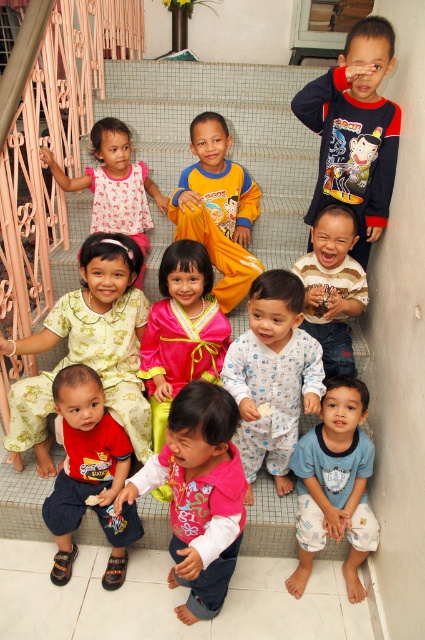
Question: Estimate the real-world distances between objects in this image. Which object is closer to the orange cotton pajamas at center?

Choices:
 (A) red cotton shirt at lower left
 (B) dark blue cotton shirt at upper right
 (C) light green floral dress at center

Answer: (B)

Question: Observing the image, what is the correct spatial positioning of blue dotted pajamas at center in reference to orange cotton pajamas at center?

Choices:
 (A) above
 (B) below

Answer: (B)

Question: Among these points, which one is farthest from the camera?

Choices:
 (A) (365, 45)
 (B) (102, 188)
 (C) (195, 483)

Answer: (B)

Question: Is white tiled stairs at center thinner than pink fabric dress at upper left?

Choices:
 (A) no
 (B) yes

Answer: (A)

Question: Which point appears farthest from the camera in this image?

Choices:
 (A) (226, 355)
 (B) (334, 474)

Answer: (B)

Question: Is pink fabric shirt at center above red cotton shirt at lower left?

Choices:
 (A) yes
 (B) no

Answer: (B)